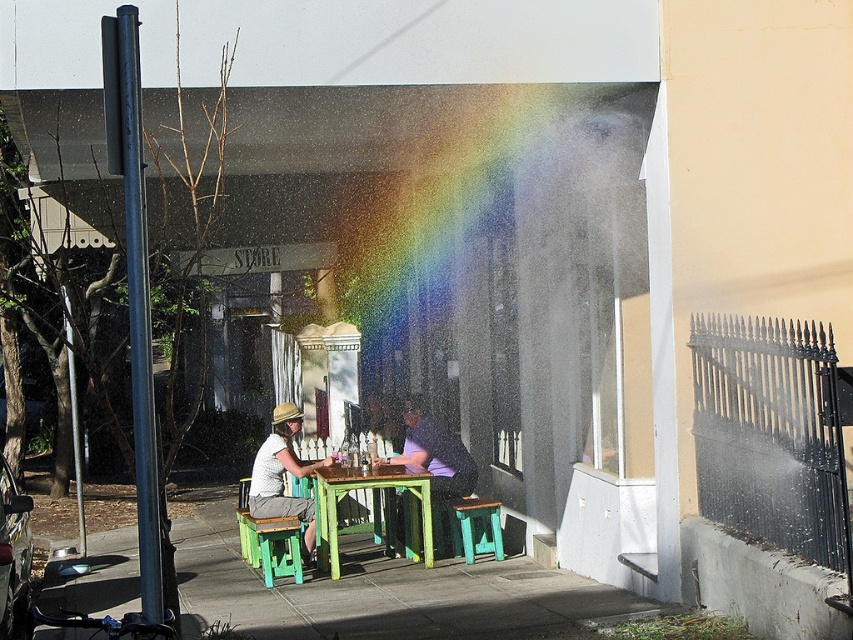
Question: Does matte white shirt at center appear on the right side of green painted wood stool at lower center?

Choices:
 (A) yes
 (B) no

Answer: (A)

Question: In this image, where is matte white shirt at center located relative to purple matte shirt at center?

Choices:
 (A) above
 (B) below

Answer: (B)

Question: Is green painted wood table at center thinner than green painted wood stool at lower center?

Choices:
 (A) no
 (B) yes

Answer: (A)

Question: Based on their relative distances, which object is farther from the green painted wood stool at lower center?

Choices:
 (A) matte white shirt at center
 (B) green painted wood table at center
 (C) purple matte shirt at center

Answer: (C)

Question: Which is nearer to the purple matte shirt at center?

Choices:
 (A) green painted wood table at center
 (B) green painted wood stool at lower center

Answer: (A)

Question: Estimate the real-world distances between objects in this image. Which object is farther from the green painted wood table at center?

Choices:
 (A) matte white shirt at center
 (B) green painted wood stool at lower center

Answer: (B)